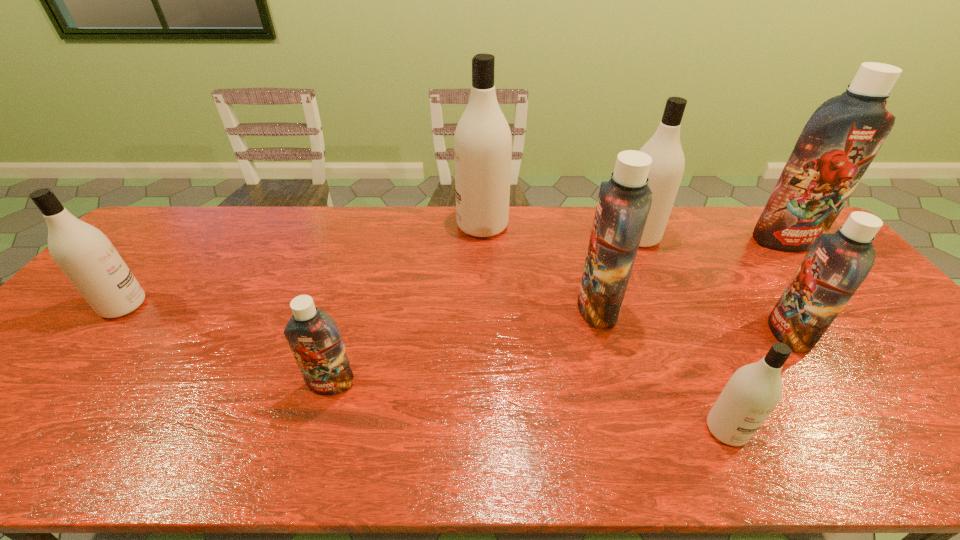
Identify the location of free space located on the front-facing side of the third smallest white shampoo. This screenshot has height=540, width=960. (510, 237).

This screenshot has height=540, width=960. I want to click on vacant space located 0.070m on the front-facing side of the third smallest white shampoo, so click(x=594, y=237).

This screenshot has width=960, height=540. Identify the location of blank space located 0.210m on the front label of the fourth shampoo from left to right. (502, 307).

Find the location of `vacant space located 0.320m on the front label of the fourth shampoo from left to right`. vacant space located 0.320m on the front label of the fourth shampoo from left to right is located at coordinates (462, 307).

What are the coordinates of `vacant area situated 0.390m on the front label of the fourth shampoo from left to right` in the screenshot? It's located at (437, 307).

The height and width of the screenshot is (540, 960). In order to click on blank space located 0.270m on the front label of the seventh shampoo from left to right in this screenshot , I will do click(668, 333).

Locate an element on the screen. The width and height of the screenshot is (960, 540). free space located on the front label of the seventh shampoo from left to right is located at coordinates (634, 333).

Image resolution: width=960 pixels, height=540 pixels. Find the location of `free location located on the front label of the seventh shampoo from left to right`. free location located on the front label of the seventh shampoo from left to right is located at coordinates (676, 333).

At what (x,y) coordinates should I click in order to perform the action: click on free space located on the front-facing side of the second smallest white shampoo. Please return your answer as a coordinate pair (x, y). This screenshot has width=960, height=540. Looking at the image, I should click on (178, 306).

The height and width of the screenshot is (540, 960). What are the coordinates of `blank space located 0.140m on the front label of the seventh farthest shampoo` in the screenshot? It's located at (310, 455).